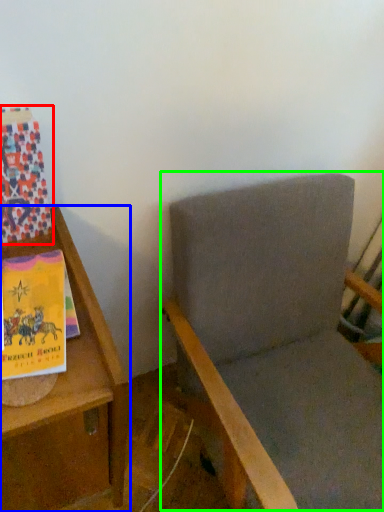
Question: Which object is the closest to the paperback book (highlighted by a red box)? Choose among these: furniture (highlighted by a blue box) or rocking chair (highlighted by a green box).

Choices:
 (A) furniture
 (B) rocking chair

Answer: (A)